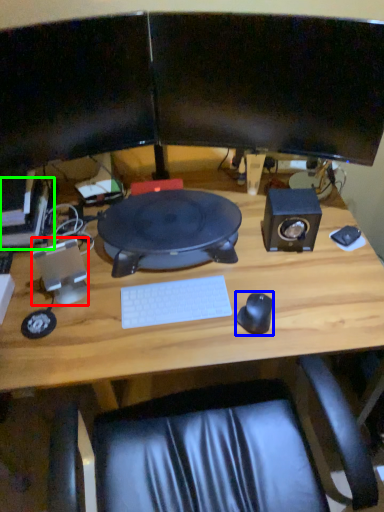
Question: Which object is the closest to the speaker (highlighted by a red box)? Choose among these: mouse (highlighted by a blue box) or computer (highlighted by a green box).

Choices:
 (A) mouse
 (B) computer

Answer: (B)